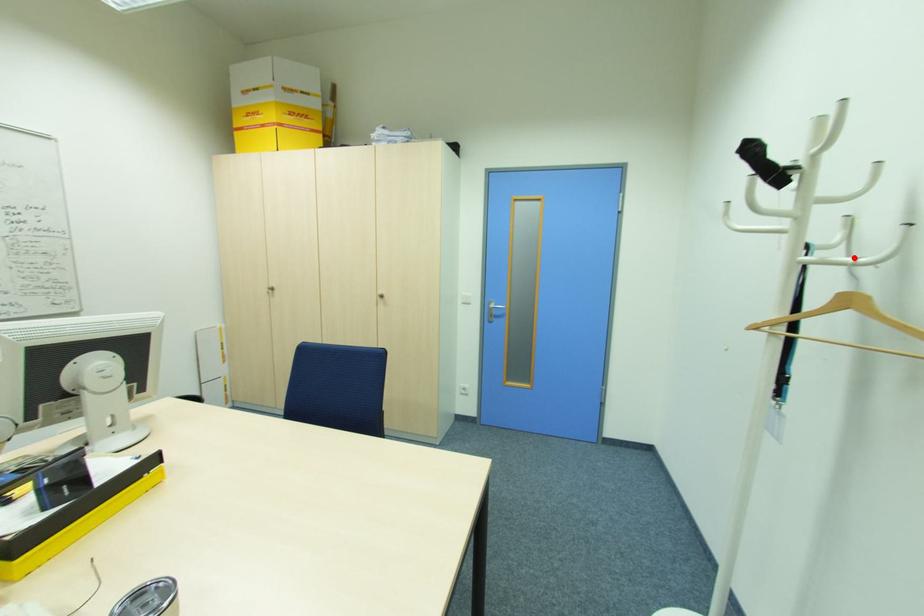
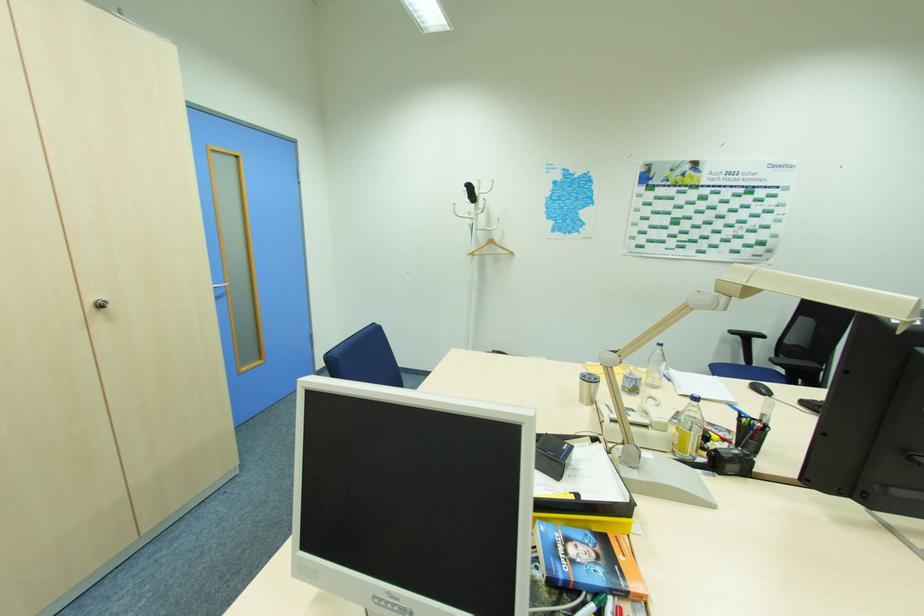
Question: I am providing you with two images of the same scene from different viewpoints. A red point is shown in image1. For the corresponding object point in image2, is it positioned nearer or farther from the camera?

Choices:
 (A) Nearer
 (B) Farther

Answer: (A)